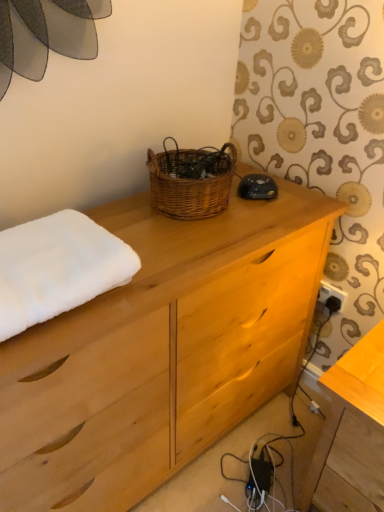
You are a GUI agent. You are given a task and a screenshot of the screen. Output one action in this format:
    pyautogui.click(x=<x>, y=<y>)
    Task: Click on the vacant space to the right of white fluffy towel at left
    This screenshot has width=384, height=512.
    Given the screenshot: What is the action you would take?
    [171, 262]